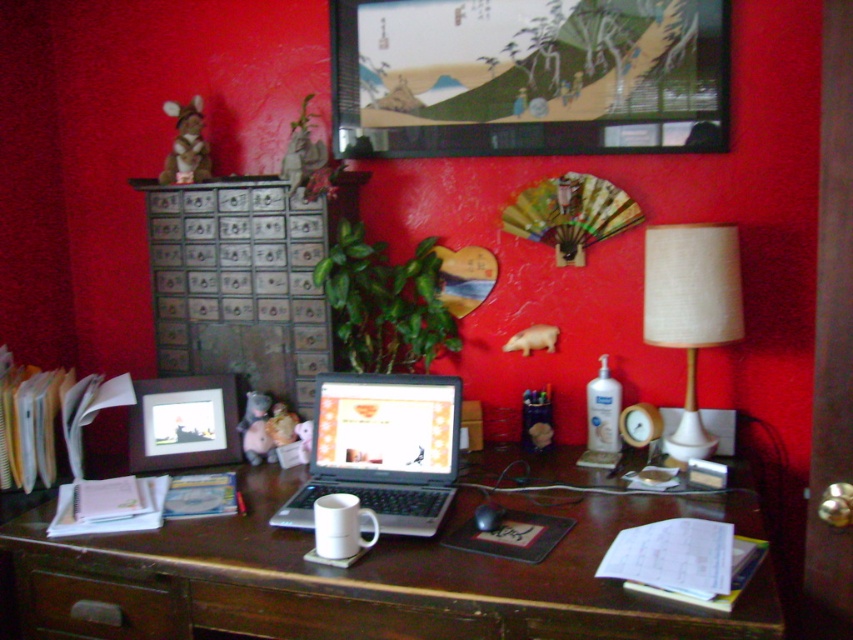
Question: Which point appears closest to the camera in this image?

Choices:
 (A) (154, 310)
 (B) (720, 304)

Answer: (B)

Question: Where is wooden file cabinet at left located in relation to silver/black laptop at center in the image?

Choices:
 (A) left
 (B) right

Answer: (A)

Question: From the image, what is the correct spatial relationship of wooden file cabinet at left in relation to white fabric lampshade at right?

Choices:
 (A) below
 (B) above

Answer: (B)

Question: Considering the relative positions of wooden file cabinet at left and brown wood drawer at lower left in the image provided, where is wooden file cabinet at left located with respect to brown wood drawer at lower left?

Choices:
 (A) below
 (B) above

Answer: (B)

Question: Which object is the closest to the silver/black laptop at center?

Choices:
 (A) matte black picture frame at center
 (B) white fabric lampshade at right
 (C) wooden desk at center

Answer: (C)

Question: Which point is farther from the camera taking this photo?

Choices:
 (A) (165, 614)
 (B) (654, 282)
 (C) (192, 394)

Answer: (C)